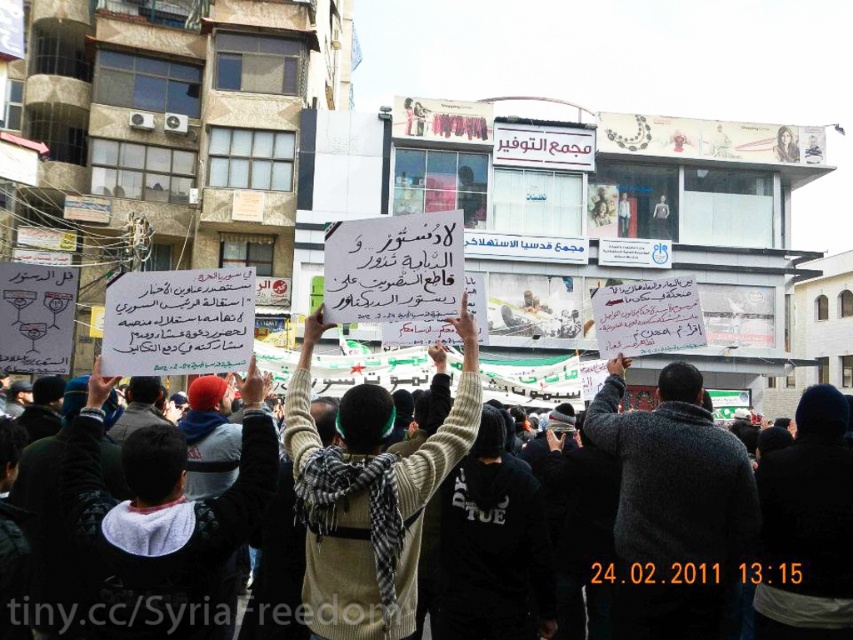
You are a photographer trying to capture both the gray wool sweater at center and the white knitted sweater at center in a single frame. Which sweater should you adjust your camera angle to focus on first to ensure both are in the shot?

The gray wool sweater at center is positioned on the right side of white knitted sweater at center, so you should focus on the white knitted sweater at center first to ensure both are captured in the frame.

You are a photographer at the demonstration and want to capture a clear shot of both the white paper sign at center and the white knitted sweater at center. Considering their sizes, which object should you focus on first to ensure it appears larger in your photo?

The white knitted sweater at center is taller than the white paper sign at center, so focusing on the white knitted sweater at center first will ensure it appears larger in the photo.

You are a photographer standing at the camera position. You want to capture a closeup of the gray wool sweater at center. Given that your camera has a maximum zoom range of 35 meters, can you achieve this without moving closer?

The gray wool sweater at center is 38.45 meters away from the camera. Since the camera can only zoom up to 35 meters, it cannot capture a closeup of the gray wool sweater at center without moving closer.